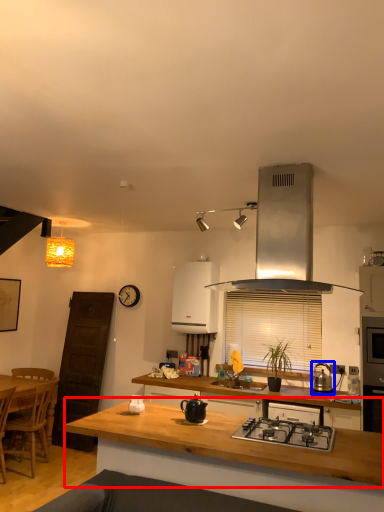
Question: Which object appears closest to the camera in this image, countertop (highlighted by a red box) or kitchen appliance (highlighted by a blue box)?

Choices:
 (A) countertop
 (B) kitchen appliance

Answer: (A)